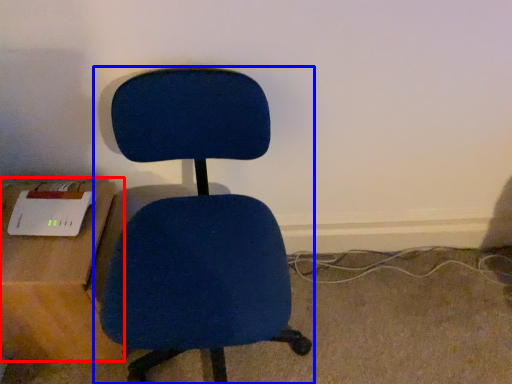
Question: Which point is closer to the camera, table (highlighted by a red box) or chair (highlighted by a blue box)?

Choices:
 (A) table
 (B) chair

Answer: (B)